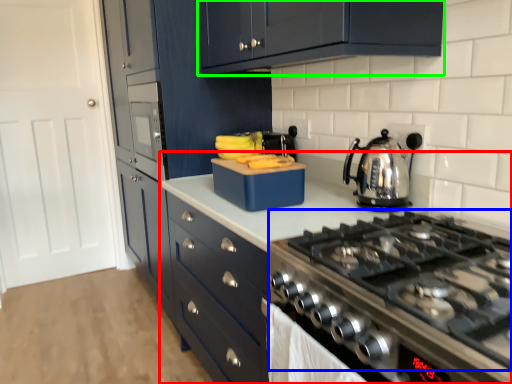
Question: Which is nearer to the countertop (highlighted by a red box)? gas stove (highlighted by a blue box) or cabinetry (highlighted by a green box).

Choices:
 (A) gas stove
 (B) cabinetry

Answer: (A)